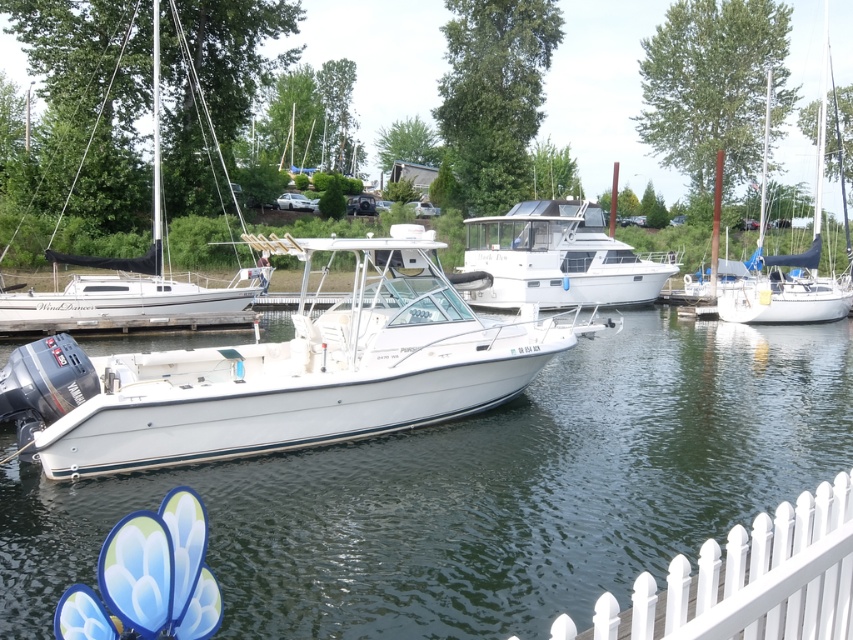
Question: Which object is farther from the camera taking this photo?

Choices:
 (A) white matte boat at center
 (B) white glossy boat at center
 (C) white picket fence at lower right
 (D) white glossy water at center

Answer: (B)

Question: Which of the following is the farthest from the observer?

Choices:
 (A) white matte boat at center
 (B) white glossy water at center

Answer: (A)

Question: Can you confirm if white picket fence at lower right is positioned below white matte sailboat at left?

Choices:
 (A) no
 (B) yes

Answer: (B)

Question: Which object is positioned farthest from the white glossy boat at center?

Choices:
 (A) white picket fence at lower right
 (B) white matte sailboat at left
 (C) white glossy water at center
 (D) white matte boat at center

Answer: (A)

Question: Is white matte boat at center positioned behind white glossy boat at center?

Choices:
 (A) yes
 (B) no

Answer: (B)

Question: Is white picket fence at lower right bigger than white glossy boat at center?

Choices:
 (A) yes
 (B) no

Answer: (B)